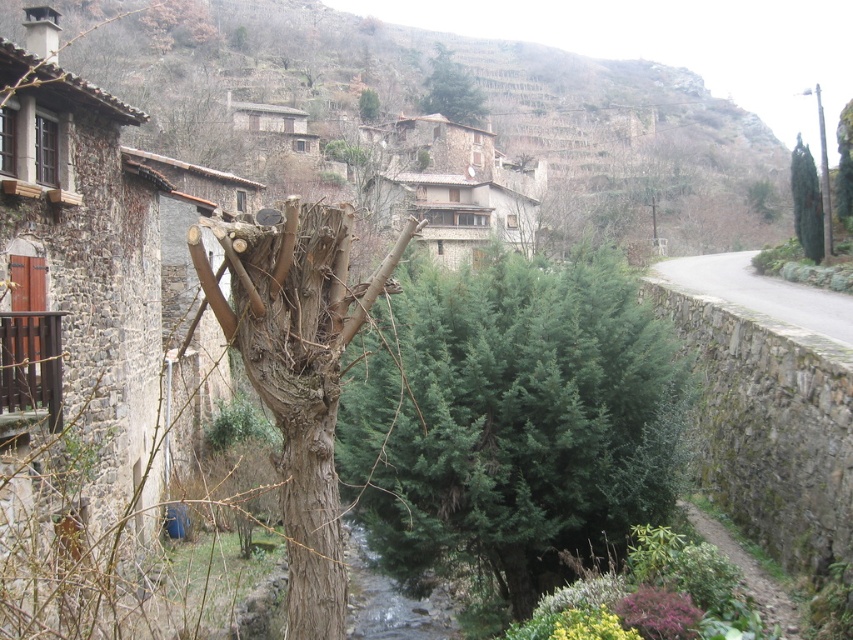
Question: Is green needle-like at center thinner than green textured tree at right?

Choices:
 (A) yes
 (B) no

Answer: (A)

Question: Observing the image, what is the correct spatial positioning of green textured tree at upper center in reference to green textured tree at right?

Choices:
 (A) above
 (B) below

Answer: (A)

Question: Which object appears closest to the camera in this image?

Choices:
 (A) green needle-like at center
 (B) gray stone wall at right

Answer: (A)

Question: Is the position of green needle-like at center more distant than that of green textured tree at upper center?

Choices:
 (A) yes
 (B) no

Answer: (B)

Question: Which point appears farthest from the camera in this image?

Choices:
 (A) (426, 509)
 (B) (372, 106)

Answer: (B)

Question: Estimate the real-world distances between objects in this image. Which object is closer to the green textured tree at upper center?

Choices:
 (A) green textured tree at right
 (B) green textured tree at center

Answer: (B)